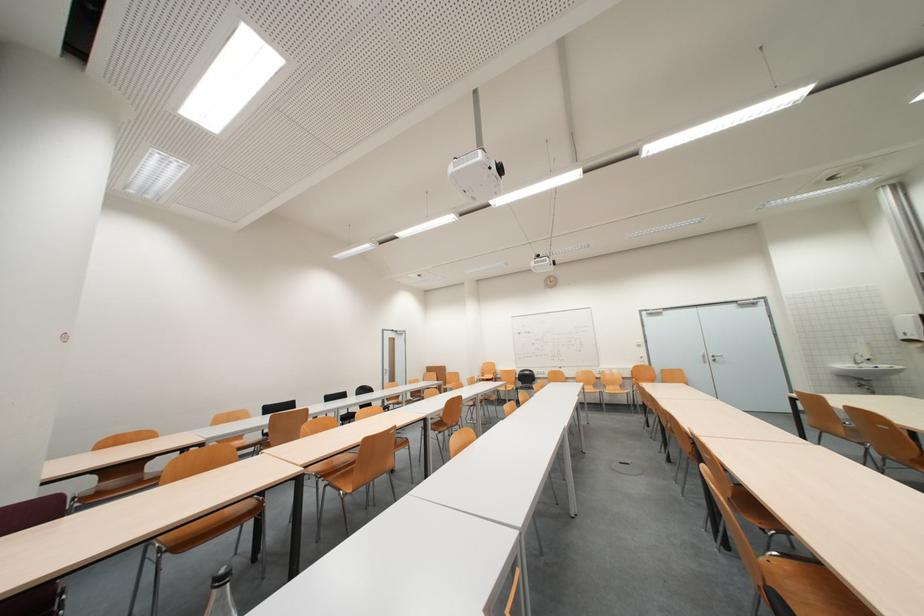
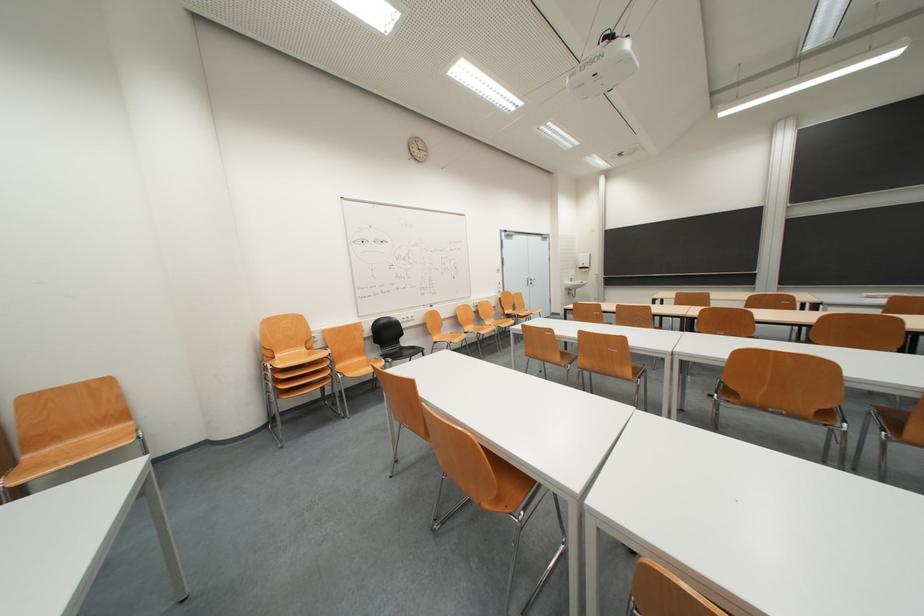
In the second image, find the point that corresponds to the point at 853,371 in the first image.

(575, 288)